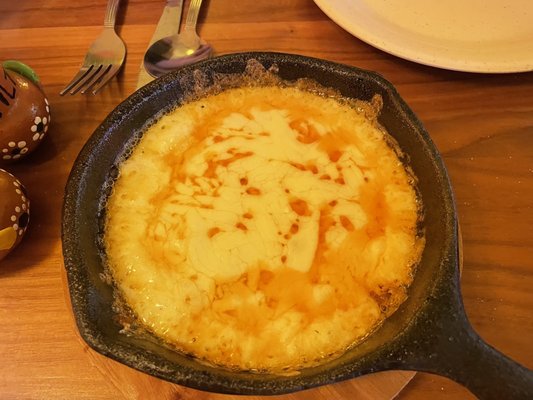
Identify the location of silverware. This screenshot has width=533, height=400. (172, 57), (104, 60), (167, 27).